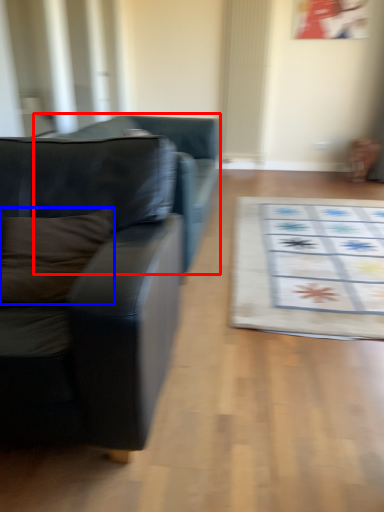
Question: Among these objects, which one is farthest to the camera, studio couch (highlighted by a red box) or pillow (highlighted by a blue box)?

Choices:
 (A) studio couch
 (B) pillow

Answer: (A)